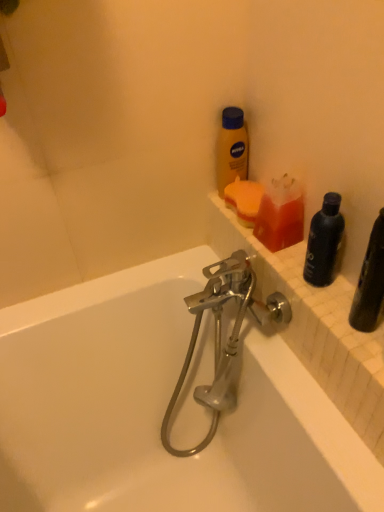
What is the approximate height of translucent orange soap at upper right, placed as the 1th cleaning product when sorted from front to back?

The height of translucent orange soap at upper right, placed as the 1th cleaning product when sorted from front to back, is 4.39 inches.

In the scene shown: What is the approximate height of white tile ledge at upper right?

It is 0.72 inches.

What are the coordinates of `translucent orange soap at upper right, the 2th cleaning product viewed from the back` in the screenshot? It's located at (280, 214).

Would you say orange sponge at upper right, which is the first cleaning product from back to front, contains white tile ledge at upper right?

No, white tile ledge at upper right is not inside orange sponge at upper right, which is the first cleaning product from back to front.

Is orange sponge at upper right, the 2th cleaning product when ordered from front to back, far away from white tile ledge at upper right?

orange sponge at upper right, the 2th cleaning product when ordered from front to back, is near white tile ledge at upper right, not far away.

Measure the distance from orange sponge at upper right, which is the first cleaning product from back to front, to white tile ledge at upper right.

orange sponge at upper right, which is the first cleaning product from back to front, is 22.62 centimeters away from white tile ledge at upper right.

Considering the positions of point (256, 189) and point (327, 394), is point (256, 189) closer or farther from the camera than point (327, 394)?

Clearly, point (256, 189) is more distant from the camera than point (327, 394).

Between point (245, 197) and point (265, 228), which one is positioned in front?

The point (265, 228) is in front.

How far apart are orange sponge at upper right, which is the first cleaning product from back to front, and translucent orange soap at upper right, the 2th cleaning product viewed from the back?

orange sponge at upper right, which is the first cleaning product from back to front, is 3.24 inches away from translucent orange soap at upper right, the 2th cleaning product viewed from the back.

Considering the positions of objects orange sponge at upper right, the 2th cleaning product when ordered from front to back, and translucent orange soap at upper right, placed as the 1th cleaning product when sorted from front to back, in the image provided, who is more to the right, orange sponge at upper right, the 2th cleaning product when ordered from front to back, or translucent orange soap at upper right, placed as the 1th cleaning product when sorted from front to back,?

Positioned to the right is translucent orange soap at upper right, placed as the 1th cleaning product when sorted from front to back.

Can you confirm if orange sponge at upper right, the 2th cleaning product when ordered from front to back, is bigger than translucent orange soap at upper right, the 2th cleaning product viewed from the back?

Correct, orange sponge at upper right, the 2th cleaning product when ordered from front to back, is larger in size than translucent orange soap at upper right, the 2th cleaning product viewed from the back.

Is translucent orange soap at upper right, placed as the 1th cleaning product when sorted from front to back, shorter than yellow matte lotion at upper center, the first bottle positioned from the top?

Yes.

Based on the photo, is yellow matte lotion at upper center, which appears as the 2th bottle when viewed from the front, at the back of translucent orange soap at upper right, the 2th cleaning product viewed from the back?

No.

From the picture: Can you confirm if translucent orange soap at upper right, the 2th cleaning product viewed from the back, is positioned to the left of yellow matte lotion at upper center, the first bottle positioned from the top?

In fact, translucent orange soap at upper right, the 2th cleaning product viewed from the back, is to the right of yellow matte lotion at upper center, the first bottle positioned from the top.

Is point (263, 229) less distant than point (367, 353)?

No, (263, 229) is behind (367, 353).

Is translucent orange soap at upper right, placed as the 1th cleaning product when sorted from front to back, turned away from white tile ledge at upper right?

translucent orange soap at upper right, placed as the 1th cleaning product when sorted from front to back, is not turned away from white tile ledge at upper right.

Is translucent orange soap at upper right, placed as the 1th cleaning product when sorted from front to back, not close to white tile ledge at upper right?

They are positioned close to each other.

In the scene shown: How different are the orientations of translucent orange soap at upper right, the 2th cleaning product viewed from the back, and white tile ledge at upper right in degrees?

The angular difference between translucent orange soap at upper right, the 2th cleaning product viewed from the back, and white tile ledge at upper right is 0.197 degrees.

Based on the photo, is translucent orange soap at upper right, placed as the 1th cleaning product when sorted from front to back, directly adjacent to black matte bottle at right, the 1th bottle viewed from the front?

translucent orange soap at upper right, placed as the 1th cleaning product when sorted from front to back, is not next to black matte bottle at right, the 1th bottle viewed from the front, and they're not touching.

From the image's perspective, is translucent orange soap at upper right, the 2th cleaning product viewed from the back, on black matte bottle at right, which is the 1th bottle from right to left?

Yes, from the image's perspective, translucent orange soap at upper right, the 2th cleaning product viewed from the back, is above black matte bottle at right, which is the 1th bottle from right to left.

Which point is more forward, (289,237) or (315,245)?

The point (315,245) is closer to the camera.

Considering the relative sizes of translucent orange soap at upper right, the 2th cleaning product viewed from the back, and black matte bottle at right, marked as the 2th bottle in a back-to-front arrangement, in the image provided, is translucent orange soap at upper right, the 2th cleaning product viewed from the back, bigger than black matte bottle at right, marked as the 2th bottle in a back-to-front arrangement,?

Incorrect, translucent orange soap at upper right, the 2th cleaning product viewed from the back, is not larger than black matte bottle at right, marked as the 2th bottle in a back-to-front arrangement.

Can you tell me how much orange sponge at upper right, which is the first cleaning product from back to front, and chrome metallic faucet at center differ in facing direction?

Answer: They differ by 5.55 degrees in their facing directions.

Would you consider orange sponge at upper right, the 2th cleaning product when ordered from front to back, to be distant from chrome metallic faucet at center?

Actually, orange sponge at upper right, the 2th cleaning product when ordered from front to back, and chrome metallic faucet at center are a little close together.

From the image's perspective, which is below, orange sponge at upper right, the 2th cleaning product when ordered from front to back, or chrome metallic faucet at center?

chrome metallic faucet at center appears lower in the image.

Considering their positions, is orange sponge at upper right, which is the first cleaning product from back to front, located in front of or behind chrome metallic faucet at center?

In the image, orange sponge at upper right, which is the first cleaning product from back to front, appears behind chrome metallic faucet at center.

Is point (283, 296) positioned before point (224, 118)?

That is True.

Does chrome metallic faucet at center have a lesser height compared to yellow matte lotion at upper center, the first bottle positioned from the top?

In fact, chrome metallic faucet at center may be taller than yellow matte lotion at upper center, the first bottle positioned from the top.

Is yellow matte lotion at upper center, which is the 2th bottle from right to left, located within chrome metallic faucet at center?

Definitely not — yellow matte lotion at upper center, which is the 2th bottle from right to left, is not inside chrome metallic faucet at center.

Is chrome metallic faucet at center directly adjacent to yellow matte lotion at upper center, which appears as the 2th bottle when viewed from the front?

chrome metallic faucet at center is not next to yellow matte lotion at upper center, which appears as the 2th bottle when viewed from the front, and they're not touching.

The height and width of the screenshot is (512, 384). Identify the location of the 2nd cleaning product positioned above the white tile ledge at upper right (from the image's perspective). (244, 200).

The height and width of the screenshot is (512, 384). What are the coordinates of `cleaning product behind the translucent orange soap at upper right, the 2th cleaning product viewed from the back` in the screenshot? It's located at (244, 200).

Looking at this image, considering their positions, is orange sponge at upper right, which is the first cleaning product from back to front, positioned closer to translucent orange soap at upper right, the 2th cleaning product viewed from the back, than black matte bottle at right, marked as the 2th bottle in a back-to-front arrangement?

orange sponge at upper right, which is the first cleaning product from back to front, is closer to translucent orange soap at upper right, the 2th cleaning product viewed from the back.

Based on their spatial positions, is black matte bottle at right, which is the 2th bottle from left to right, or chrome metallic faucet at center further from translucent orange soap at upper right, the 2th cleaning product viewed from the back?

chrome metallic faucet at center.

Which object lies nearer to the anchor point chrome metallic faucet at center, translucent orange soap at upper right, placed as the 1th cleaning product when sorted from front to back, or black matte bottle at right, which is the 2th bottle from left to right?

translucent orange soap at upper right, placed as the 1th cleaning product when sorted from front to back.

From the picture: Considering their positions, is black matte bottle at right, the 1th bottle viewed from the front, positioned further to yellow matte lotion at upper center, which is counted as the 1th bottle, starting from the back, than chrome metallic faucet at center?

chrome metallic faucet at center.

Based on their spatial positions, is yellow matte lotion at upper center, the second bottle positioned from the bottom, or orange sponge at upper right, the 2th cleaning product when ordered from front to back, closer to white tile ledge at upper right?

orange sponge at upper right, the 2th cleaning product when ordered from front to back, lies closer to white tile ledge at upper right than the other object.

Considering their positions, is translucent orange soap at upper right, placed as the 1th cleaning product when sorted from front to back, positioned closer to chrome metallic faucet at center than yellow matte lotion at upper center, which is counted as the 1th bottle, starting from the back?

The object closer to chrome metallic faucet at center is translucent orange soap at upper right, placed as the 1th cleaning product when sorted from front to back.

When comparing their distances from orange sponge at upper right, the 2th cleaning product when ordered from front to back, does yellow matte lotion at upper center, the second bottle positioned from the bottom, or chrome metallic faucet at center seem closer?

yellow matte lotion at upper center, the second bottle positioned from the bottom, is closer to orange sponge at upper right, the 2th cleaning product when ordered from front to back.

Considering their positions, is yellow matte lotion at upper center, the first bottle viewed from the left, positioned further to orange sponge at upper right, the 2th cleaning product when ordered from front to back, than translucent orange soap at upper right, placed as the 1th cleaning product when sorted from front to back?

translucent orange soap at upper right, placed as the 1th cleaning product when sorted from front to back, lies further to orange sponge at upper right, the 2th cleaning product when ordered from front to back, than the other object.

You are a GUI agent. You are given a task and a screenshot of the screen. Output one action in this format:
    pyautogui.click(x=<x>, y=<y>)
    Task: Click on the ledge between yellow matte lotion at upper center, which is the 2th bottle from right to left, and chrome metallic faucet at center, in the vertical direction
    This screenshot has width=384, height=512.
    Given the screenshot: What is the action you would take?
    pyautogui.click(x=316, y=326)

This screenshot has width=384, height=512. In order to click on ledge between translucent orange soap at upper right, the 2th cleaning product viewed from the back, and chrome metallic faucet at center, in the vertical direction in this screenshot , I will do `click(316, 326)`.

This screenshot has height=512, width=384. I want to click on cleaning product positioned between white tile ledge at upper right and orange sponge at upper right, which is the first cleaning product from back to front, from near to far, so click(280, 214).

Identify the location of cleaning product located between black matte bottle at right, marked as the 2th bottle in a back-to-front arrangement, and orange sponge at upper right, which is the first cleaning product from back to front, in the depth direction. This screenshot has height=512, width=384. (280, 214).